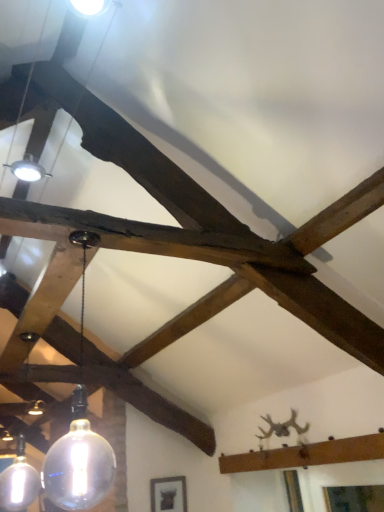
Question: From the image's perspective, is transparent glass bulb at center, positioned as the first lamp in right-to-left order, located above matte black frame at lower center?

Choices:
 (A) no
 (B) yes

Answer: (B)

Question: Is matte black frame at lower center at the back of transparent glass bulb at center, the first lamp in the front-to-back sequence?

Choices:
 (A) yes
 (B) no

Answer: (B)

Question: Can you confirm if transparent glass bulb at center, which is the 2th lamp from left to right, is bigger than matte black frame at lower center?

Choices:
 (A) yes
 (B) no

Answer: (A)

Question: Is transparent glass bulb at center, the 2th lamp from the back, further to the viewer compared to matte black frame at lower center?

Choices:
 (A) no
 (B) yes

Answer: (A)

Question: From a real-world perspective, is transparent glass bulb at center, positioned as the first lamp in right-to-left order, located higher than matte black frame at lower center?

Choices:
 (A) yes
 (B) no

Answer: (A)

Question: In the image, is matte glass globe at lower left, the 1th lamp when ordered from left to right, positioned in front of or behind matte black frame at lower center?

Choices:
 (A) behind
 (B) front

Answer: (B)

Question: Considering the relative positions of matte glass globe at lower left, positioned as the second lamp in front-to-back order, and matte black frame at lower center in the image provided, is matte glass globe at lower left, positioned as the second lamp in front-to-back order, to the left or to the right of matte black frame at lower center?

Choices:
 (A) left
 (B) right

Answer: (A)

Question: From a real-world perspective, is matte glass globe at lower left, the 1th lamp positioned from the back, positioned above or below matte black frame at lower center?

Choices:
 (A) above
 (B) below

Answer: (A)

Question: Based on their sizes in the image, would you say matte glass globe at lower left, the 1th lamp when ordered from left to right, is bigger or smaller than matte black frame at lower center?

Choices:
 (A) small
 (B) big

Answer: (B)

Question: Relative to matte glass globe at lower left, the 1th lamp when ordered from left to right, is transparent glass bulb at center, the 2th lamp from the back, in front or behind?

Choices:
 (A) front
 (B) behind

Answer: (A)

Question: Based on their positions, is transparent glass bulb at center, the first lamp in the front-to-back sequence, located to the left or right of matte glass globe at lower left, the 1th lamp when ordered from left to right?

Choices:
 (A) right
 (B) left

Answer: (A)

Question: From the image's perspective, relative to matte glass globe at lower left, positioned as the second lamp in front-to-back order, is transparent glass bulb at center, positioned as the first lamp in right-to-left order, above or below?

Choices:
 (A) below
 (B) above

Answer: (B)

Question: Which is correct: transparent glass bulb at center, the first lamp in the front-to-back sequence, is inside matte glass globe at lower left, which is the second lamp from right to left, or outside of it?

Choices:
 (A) outside
 (B) inside

Answer: (A)

Question: Is point (160, 495) positioned closer to the camera than point (77, 460)?

Choices:
 (A) farther
 (B) closer

Answer: (A)

Question: Is matte black frame at lower center inside the boundaries of transparent glass bulb at center, the first lamp in the front-to-back sequence, or outside?

Choices:
 (A) inside
 (B) outside

Answer: (B)